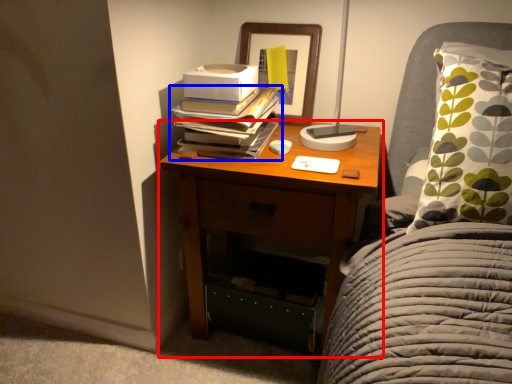
Question: Among these objects, which one is farthest to the camera, nightstand (highlighted by a red box) or book (highlighted by a blue box)?

Choices:
 (A) nightstand
 (B) book

Answer: (B)